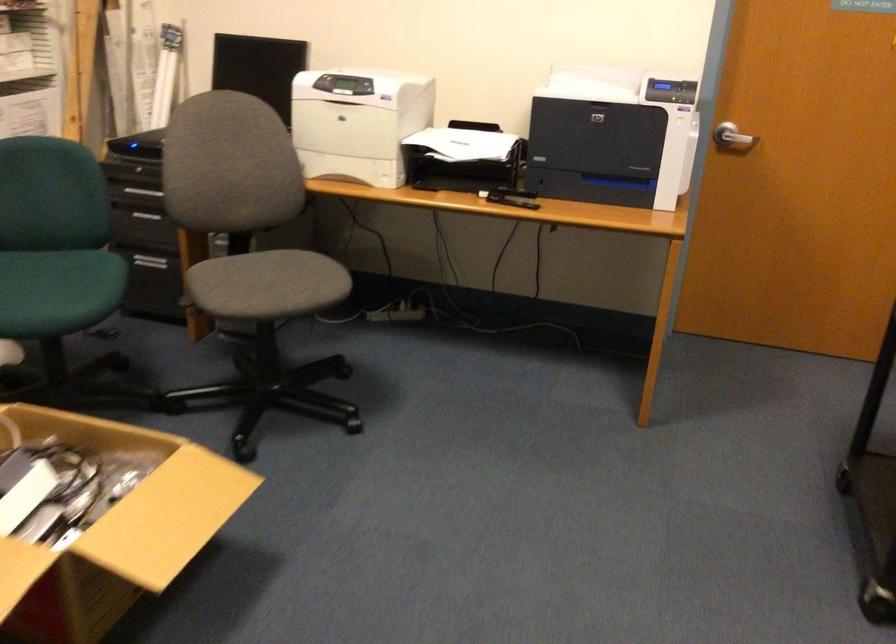
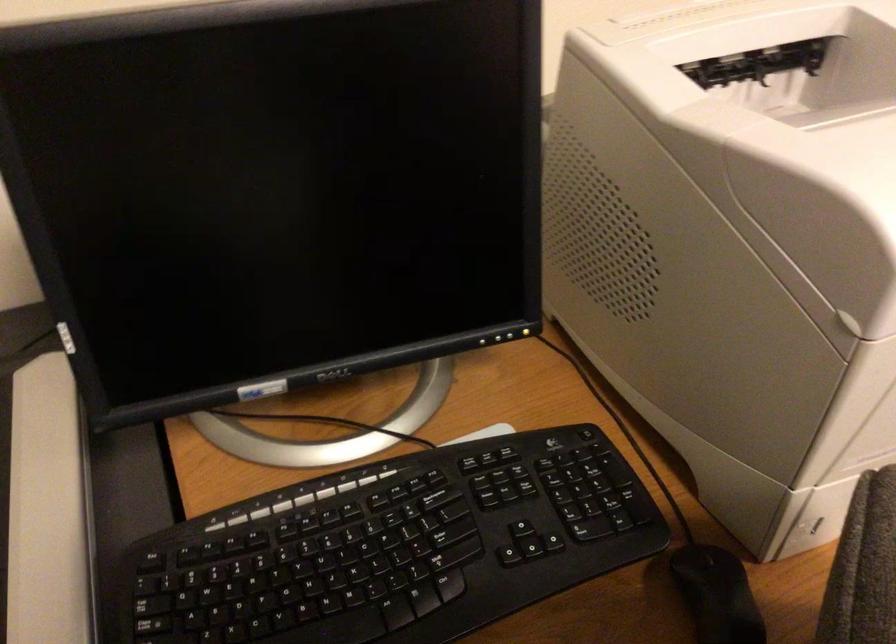
In the second image, find the point that corresponds to (289,120) in the first image.

(484, 341)